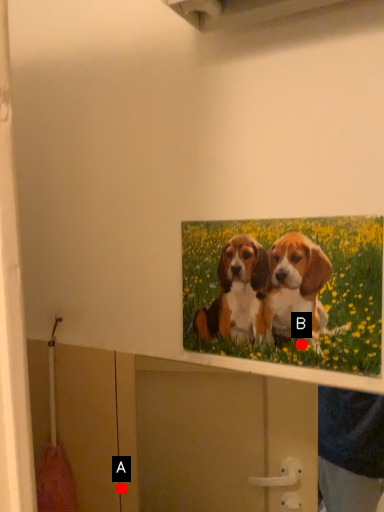
Question: Two points are circled on the image, labeled by A and B beside each circle. Among these points, which one is nearest to the camera?

Choices:
 (A) A is closer
 (B) B is closer

Answer: (B)